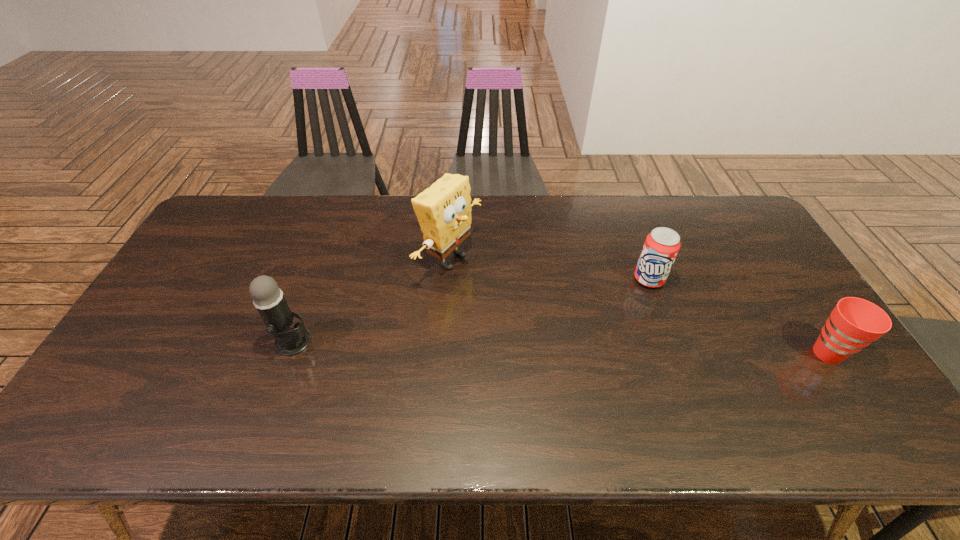
This screenshot has height=540, width=960. What are the coordinates of `vacant area that lies between the rightmost object and the third object from left to right` in the screenshot? It's located at (738, 316).

You are a GUI agent. You are given a task and a screenshot of the screen. Output one action in this format:
    pyautogui.click(x=<x>, y=<y>)
    Task: Click on the free area in between the sponge and the cup
    
    Given the screenshot: What is the action you would take?
    pyautogui.click(x=638, y=306)

I want to click on free space between the sponge and the third object from left to right, so click(549, 269).

Identify which object is the closest to the rightmost object. Please provide its 2D coordinates. Your answer should be formatted as a tuple, i.e. [(x, y)], where the tuple contains the x and y coordinates of a point satisfying the conditions above.

[(661, 246)]

Identify which object is located as the second nearest to the microphone. Please provide its 2D coordinates. Your answer should be formatted as a tuple, i.e. [(x, y)], where the tuple contains the x and y coordinates of a point satisfying the conditions above.

[(661, 246)]

Where is `free location that satisfies the following two spatial constraints: 1. on the front side of the cup; 2. on the right side of the third object from right to left`? The image size is (960, 540). free location that satisfies the following two spatial constraints: 1. on the front side of the cup; 2. on the right side of the third object from right to left is located at coordinates (444, 353).